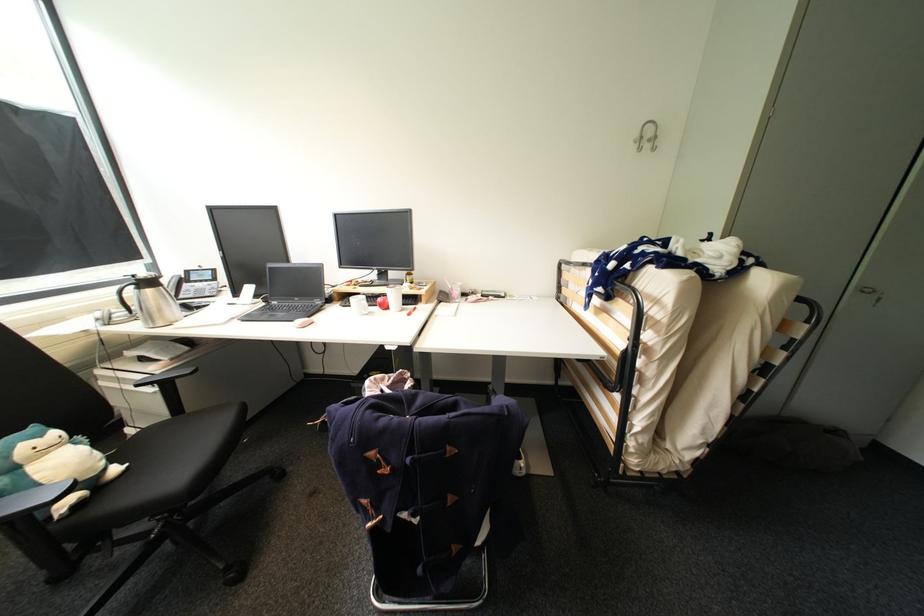
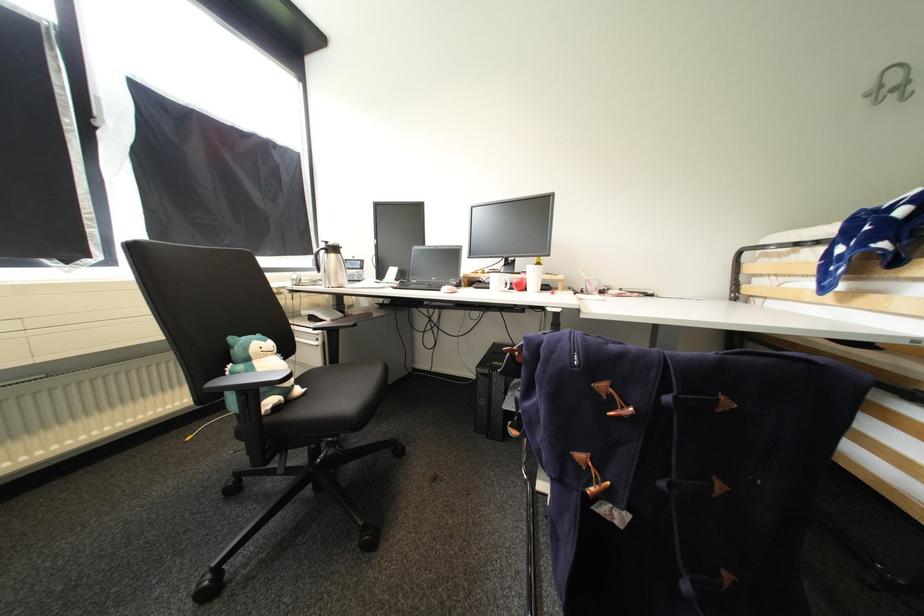
In the second image, find the point that corresponds to point (124, 469) in the first image.

(306, 391)